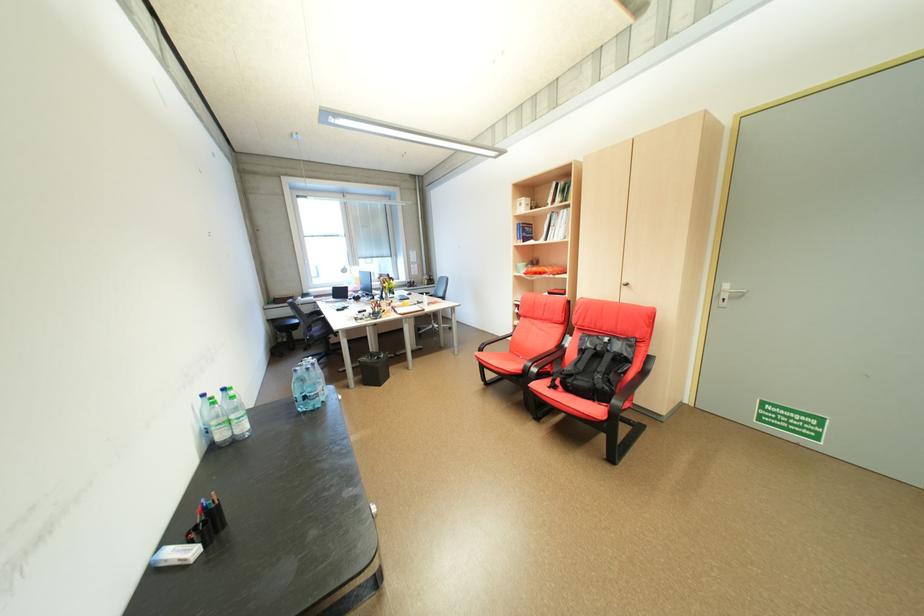
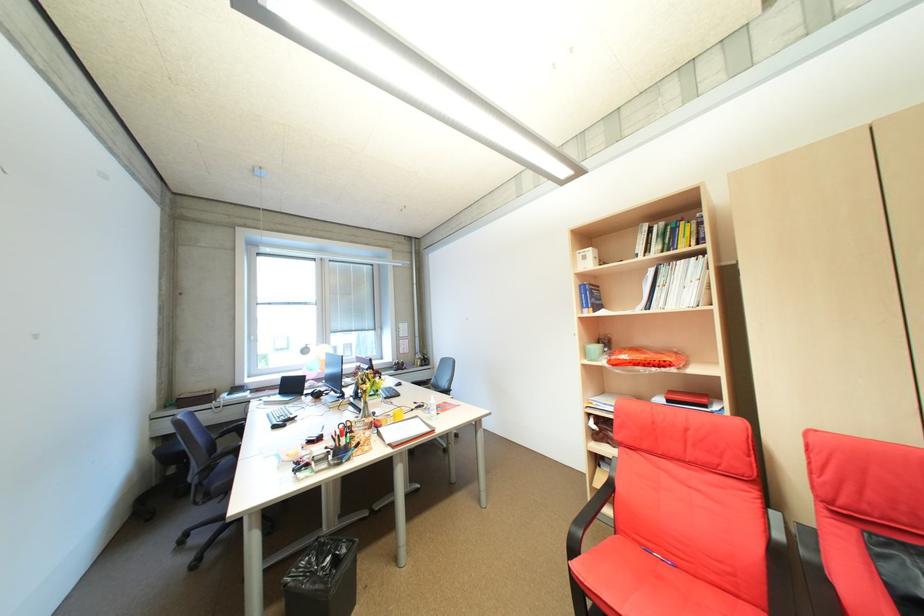
Question: I am providing you with two images of the same scene from different viewpoints. Which of the following objects are not visible in image2?

Choices:
 (A) white telephone handset
 (B) black chair armrest
 (C) black computer mouse
 (D) none of these

Answer: (D)